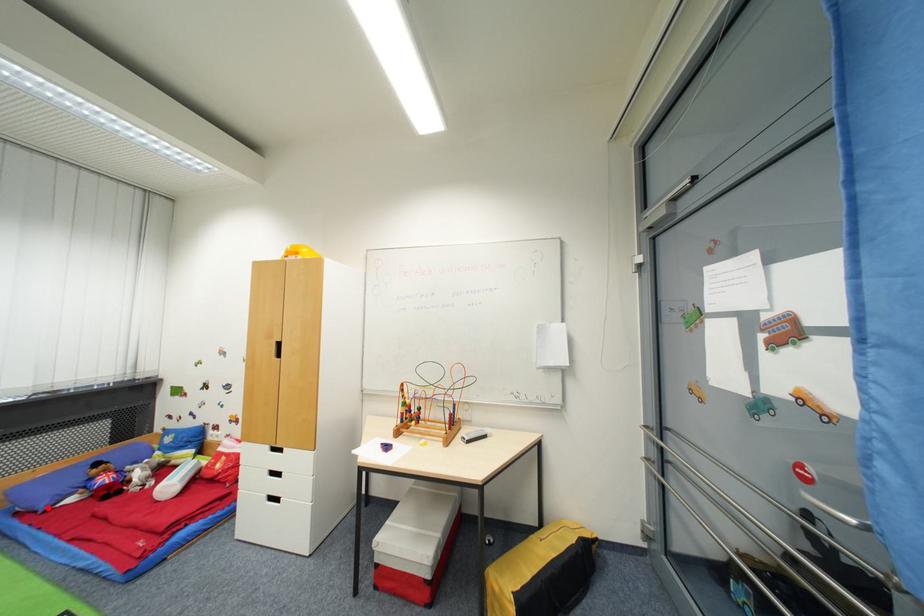
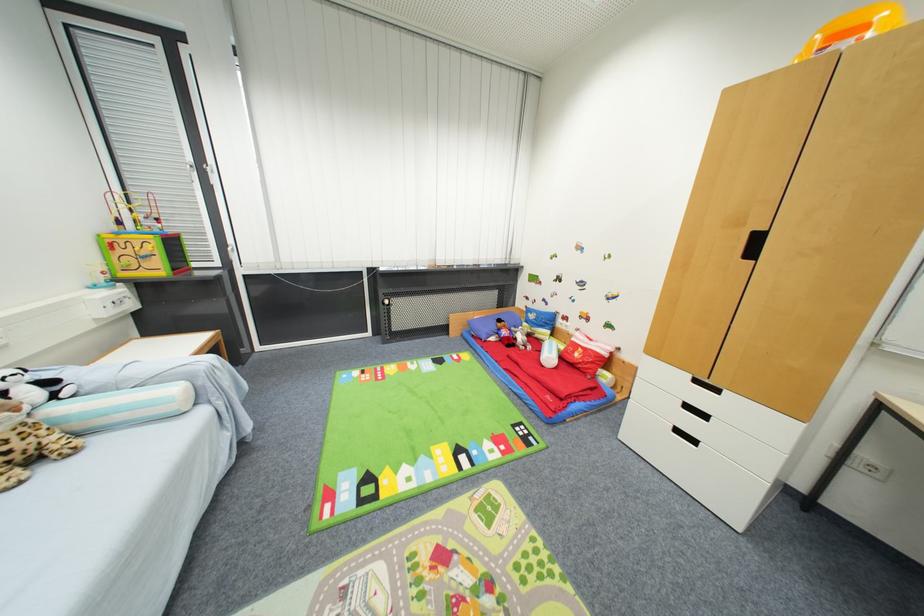
Question: A red point is marked in image1. In image2, is the corresponding 3D point closer to the camera or farther? Reply with the corresponding letter.

Choices:
 (A) The corresponding 3D point is closer.
 (B) The corresponding 3D point is farther.

Answer: (B)